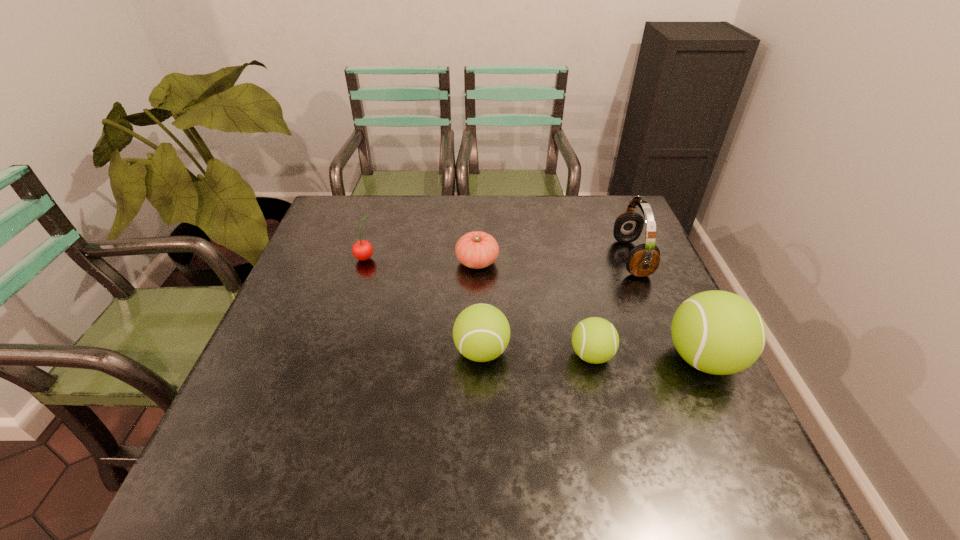
You are a GUI agent. You are given a task and a screenshot of the screen. Output one action in this format:
    pyautogui.click(x=<x>, y=<y>)
    Task: Click on the empty space between the tomato and the cherry
    Image resolution: width=960 pixels, height=540 pixels.
    Given the screenshot: What is the action you would take?
    pyautogui.click(x=421, y=260)

This screenshot has width=960, height=540. In order to click on free point between the headset and the tallest tennis ball in this screenshot , I will do (667, 308).

Locate an element on the screen. free spot between the tallest tennis ball and the headset is located at coordinates (667, 308).

This screenshot has height=540, width=960. Identify the location of free space between the second shortest tennis ball and the fourth object from left to right. (537, 353).

Identify the location of free spot between the headset and the tomato. click(554, 260).

This screenshot has height=540, width=960. What are the coordinates of `vacant area between the rightmost tennis ball and the second tennis ball from right to left` in the screenshot? It's located at (647, 357).

I want to click on object that stands as the closest to the tomato, so click(x=481, y=332).

In order to click on object that ranks as the second closest to the leftmost tennis ball in this screenshot , I will do `click(476, 250)`.

Locate which tennis ball ranks in proximity to the rightmost tennis ball. Please provide its 2D coordinates. Your answer should be formatted as a tuple, i.e. [(x, y)], where the tuple contains the x and y coordinates of a point satisfying the conditions above.

[(595, 340)]

Where is `the closest tennis ball to the tomato`? the closest tennis ball to the tomato is located at coordinates (481, 332).